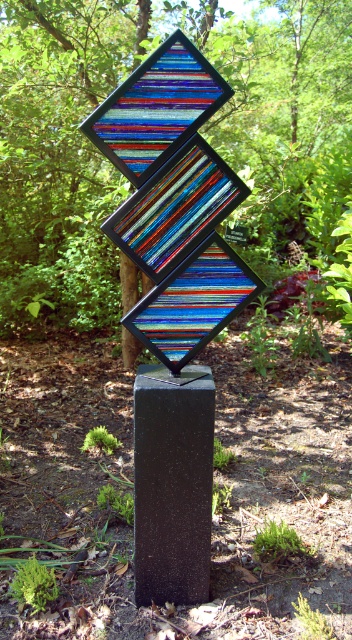
Question: Is green leafy tree at center further to camera compared to black polished stone at center?

Choices:
 (A) no
 (B) yes

Answer: (B)

Question: Can you confirm if green leafy tree at center is bigger than black polished stone at center?

Choices:
 (A) yes
 (B) no

Answer: (A)

Question: In this image, where is green leafy tree at center located relative to black polished stone at center?

Choices:
 (A) left
 (B) right

Answer: (A)

Question: Among these points, which one is farthest from the camera?

Choices:
 (A) (45, 250)
 (B) (200, 392)

Answer: (A)

Question: Which object is closer to the camera taking this photo?

Choices:
 (A) black polished stone at center
 (B) green leafy tree at center

Answer: (A)

Question: Which point is farther to the camera?

Choices:
 (A) black polished stone at center
 (B) green leafy tree at center

Answer: (B)